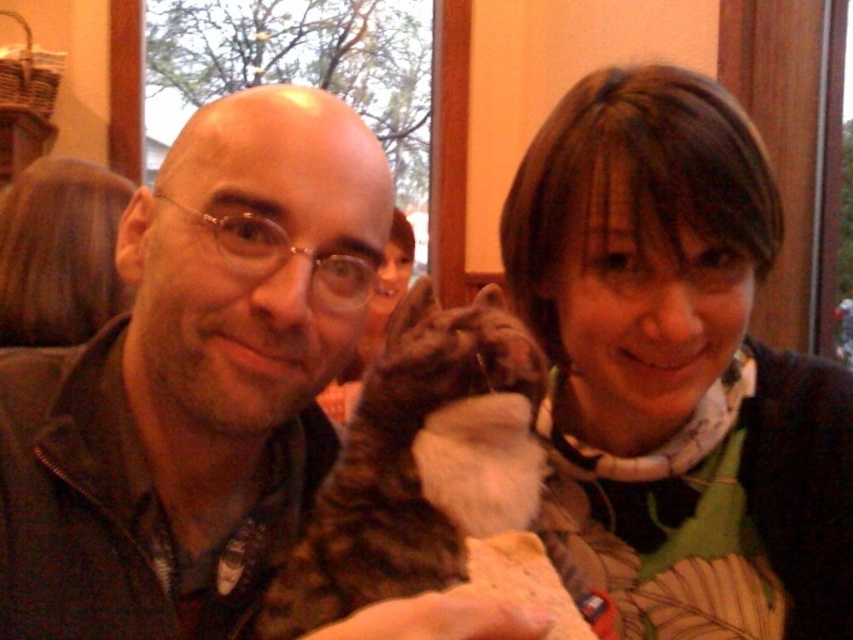
You are a photographer standing 10 inches away from the scene. You want to take a photo of the matte black jacket at center and the matte brown hair at upper right without any obstruction. Can you step back a little to ensure both are fully visible in the frame?

The matte black jacket at center is 9.85 inches away from the matte brown hair at upper right. Since you are already 10 inches away from the scene, stepping back slightly would allow both objects to be fully visible in the frame without obstruction.

You are a photographer standing in front of the scene described. You want to capture a closeup shot of the matte brown hair at upper right without including any other elements in the frame. Based on your current position, is the distance sufficient to achieve this?

The matte brown hair at upper right and viewer are 22.29 inches apart from each other. To capture a closeup shot, the distance should be closer than 22.29 inches, so you need to move closer to the matte brown hair at upper right to achieve the desired closeup without including other elements.

From the picture: You are a photographer adjusting your camera settings to focus on the matte black jacket at center. Based on the coordinates provided in the Objects Description, can you determine if the jacket is positioned closer to the top or bottom of the image?

The matte black jacket at center is located at point (194, 380). In coordinate systems, the y value of 0.229 indicates it is closer to the bottom of the image since lower y values correspond to positions nearer the bottom.